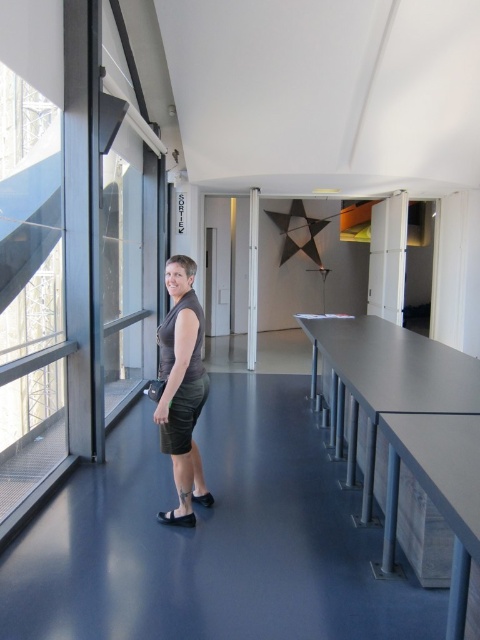
Does dark green textured dress at center have a lesser height compared to white glossy pillar at center?

Yes, dark green textured dress at center is shorter than white glossy pillar at center.

Which is below, dark green textured dress at center or white glossy pillar at center?

dark green textured dress at center is lower down.

The width and height of the screenshot is (480, 640). What do you see at coordinates (181, 380) in the screenshot?
I see `dark green textured dress at center` at bounding box center [181, 380].

Locate an element on the screen. The height and width of the screenshot is (640, 480). dark green textured dress at center is located at coordinates (181, 380).

Based on the photo, who is more forward, (247,348) or (205,493)?

Point (205,493) is in front.

From the picture: Between white glossy pillar at center and black leather sandal at lower center, which one is positioned higher?

white glossy pillar at center

Where is `white glossy pillar at center`? The image size is (480, 640). white glossy pillar at center is located at coordinates (252, 278).

Is matte black skirt at center positioned in front of white glossy pillar at center?

Yes, matte black skirt at center is in front of white glossy pillar at center.

Identify the location of matte black skirt at center. (181, 380).

Locate an element on the screen. This screenshot has width=480, height=640. matte black skirt at center is located at coordinates pyautogui.click(x=181, y=380).